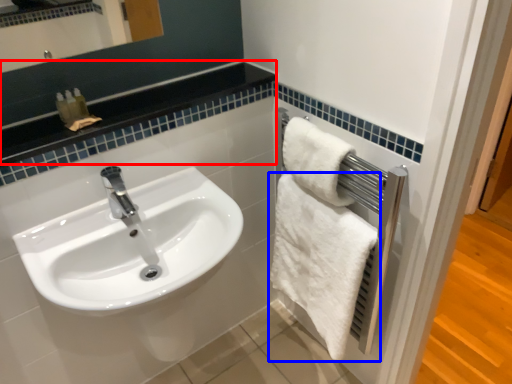
Question: Which object appears closest to the camera in this image, balustrade (highlighted by a red box) or towel (highlighted by a blue box)?

Choices:
 (A) balustrade
 (B) towel

Answer: (A)